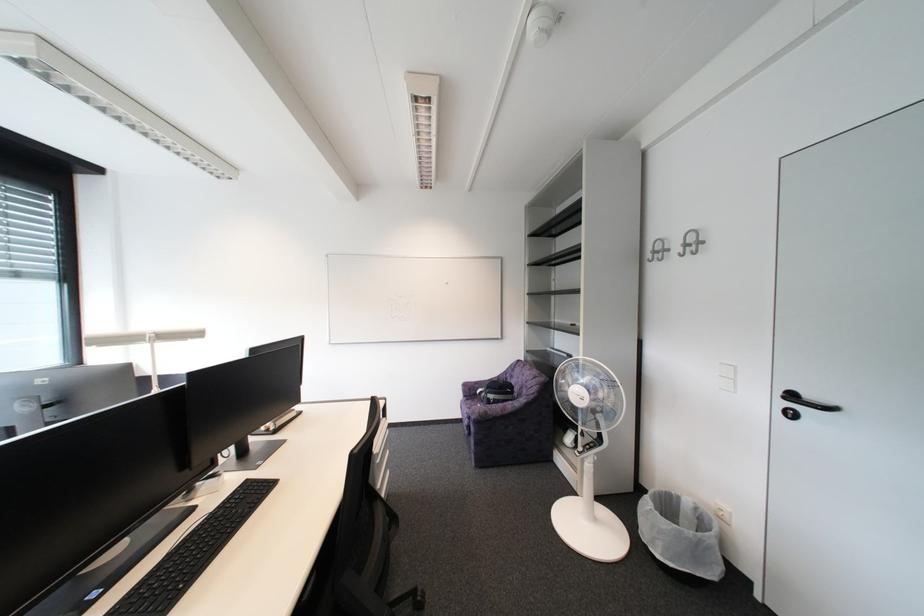
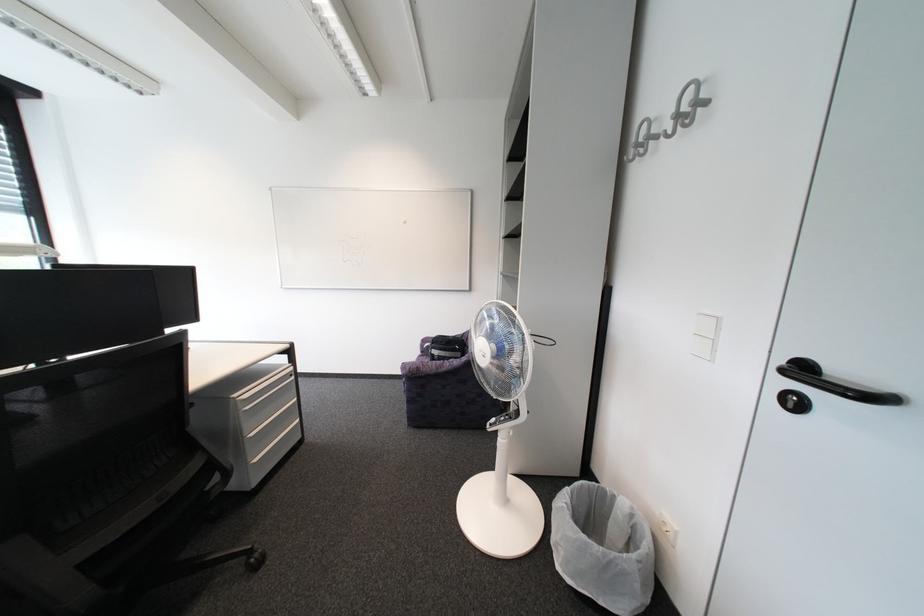
What movement of the cameraman would produce the second image?

The movement direction of the cameraman is right, forward.